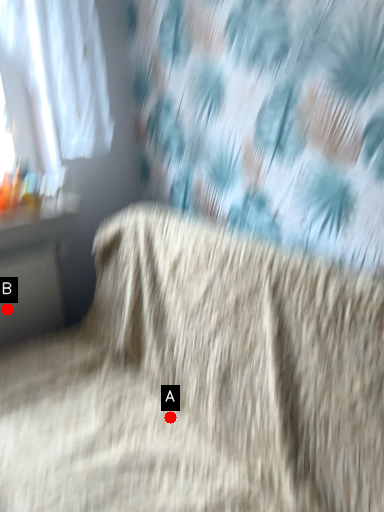
Question: Two points are circled on the image, labeled by A and B beside each circle. Which point is closer to the camera?

Choices:
 (A) A is closer
 (B) B is closer

Answer: (A)